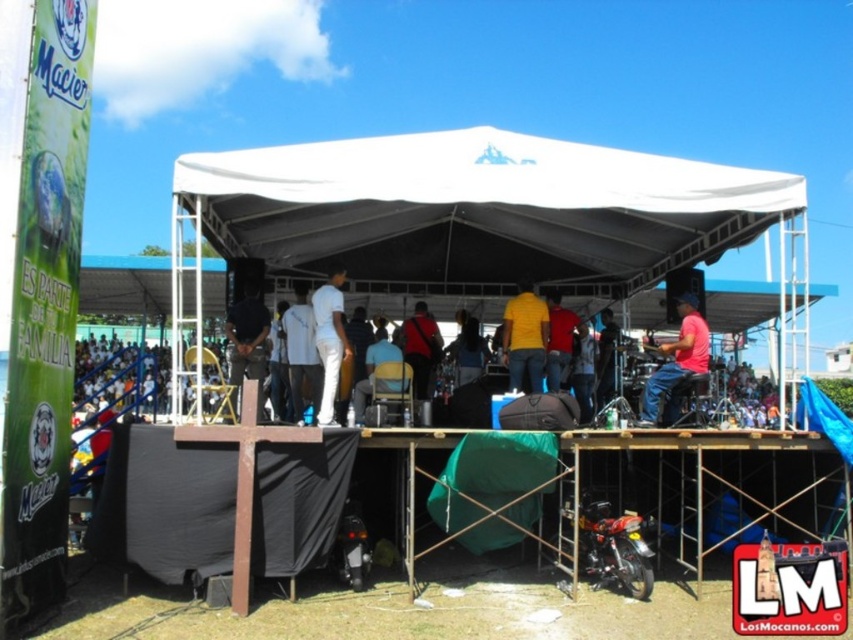
Is white fabric tent at center to the left of pink fabric at center from the viewer's perspective?

Correct, you'll find white fabric tent at center to the left of pink fabric at center.

Between white fabric tent at center and pink fabric at center, which one is positioned lower?

Positioned lower is pink fabric at center.

From the picture: Who is more distant from viewer, (x=395, y=163) or (x=672, y=410)?

The point (x=672, y=410) is more distant.

The width and height of the screenshot is (853, 640). I want to click on white fabric tent at center, so click(x=485, y=212).

Looking at this image, which of these two, white fabric shirt at center or dark blue jeans at center, stands taller?

white fabric shirt at center

Can you confirm if white fabric shirt at center is smaller than dark blue jeans at center?

Actually, white fabric shirt at center might be larger than dark blue jeans at center.

The height and width of the screenshot is (640, 853). Find the location of `white fabric shirt at center`. white fabric shirt at center is located at coordinates (300, 353).

Is the position of white fabric shirt at center less distant than that of matte black shirt at center?

That is True.

Which is in front, point (314, 404) or point (445, 349)?

Point (314, 404) is in front.

At what (x,y) coordinates should I click in order to perform the action: click on white fabric shirt at center. Please return your answer as a coordinate pair (x, y). The image size is (853, 640). Looking at the image, I should click on (300, 353).

Where is `white fabric shirt at center`? The image size is (853, 640). white fabric shirt at center is located at coordinates (300, 353).